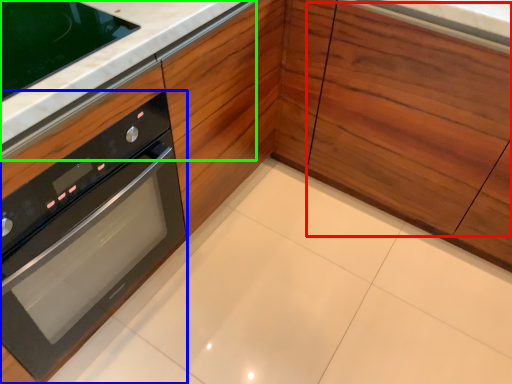
Question: Which object is the farthest from drawer (highlighted by a red box)? Choose among these: oven (highlighted by a blue box) or counter top (highlighted by a green box).

Choices:
 (A) oven
 (B) counter top

Answer: (A)